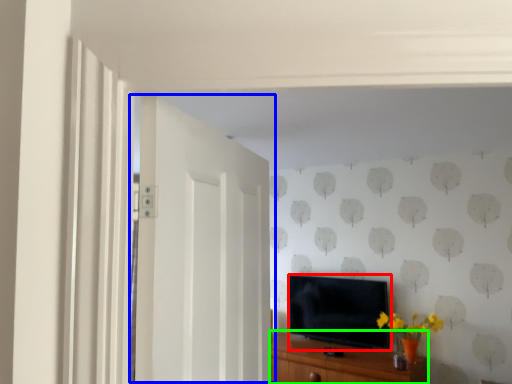
Question: Which is farther away from television (highlighted by a red box)? door (highlighted by a blue box) or cabinetry (highlighted by a green box)?

Choices:
 (A) door
 (B) cabinetry

Answer: (A)